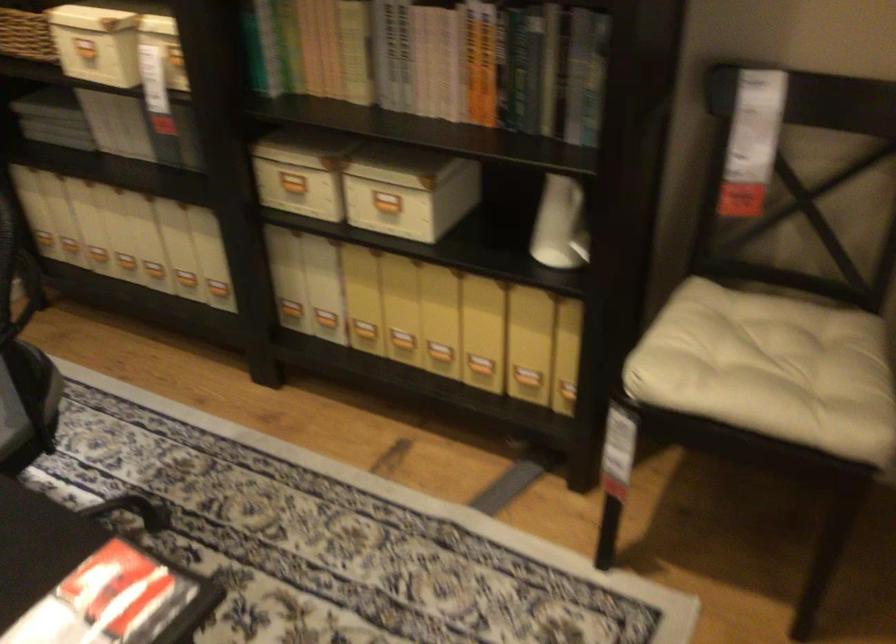
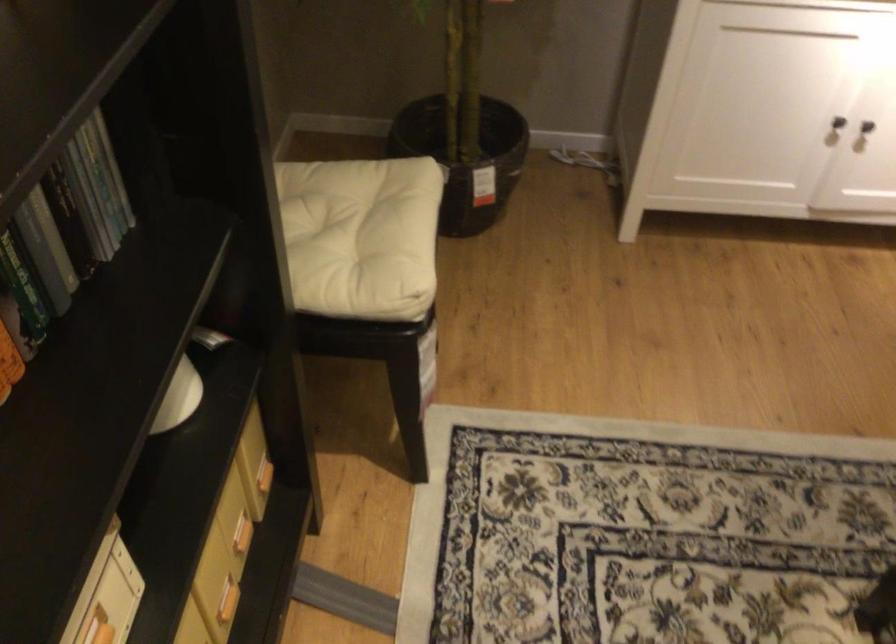
Locate, in the second image, the point that corresponds to (596,102) in the first image.

(95, 198)